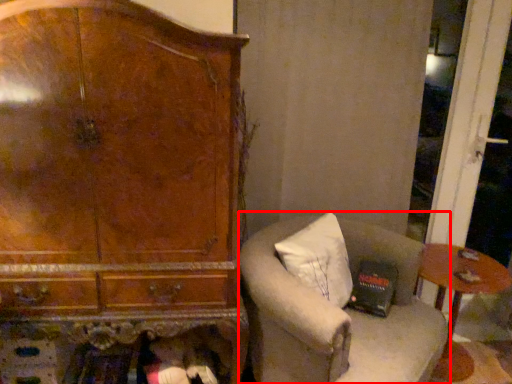
Question: Observing the image, what is the correct spatial positioning of chair (annotated by the red box) in reference to table?

Choices:
 (A) right
 (B) left

Answer: (B)